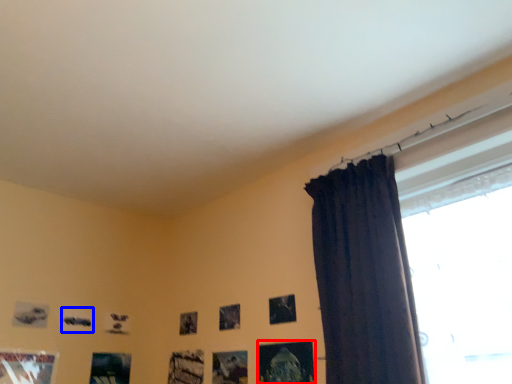
Question: Which object is closer to the camera taking this photo, picture frame (highlighted by a red box) or picture frame (highlighted by a blue box)?

Choices:
 (A) picture frame
 (B) picture frame

Answer: (A)